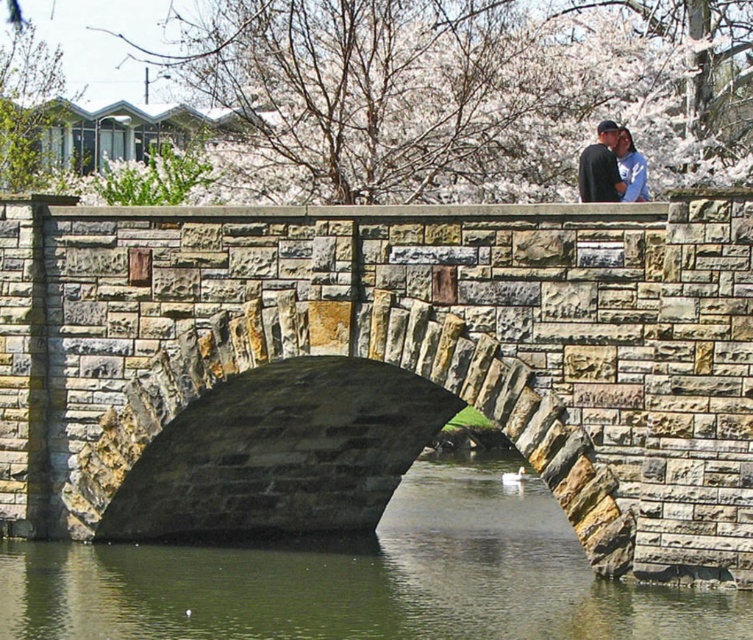
Question: Based on their relative distances, which object is nearer to the blue denim jacket at upper center?

Choices:
 (A) natural stone bridge at center
 (B) green stone river at center
 (C) matte black jacket at upper center

Answer: (C)

Question: Considering the relative positions of natural stone bridge at center and blue denim jacket at upper center in the image provided, where is natural stone bridge at center located with respect to blue denim jacket at upper center?

Choices:
 (A) left
 (B) right

Answer: (A)

Question: Does natural stone bridge at center lie in front of blue denim jacket at upper center?

Choices:
 (A) yes
 (B) no

Answer: (A)

Question: Among these objects, which one is nearest to the camera?

Choices:
 (A) green stone river at center
 (B) blue denim jacket at upper center
 (C) natural stone bridge at center
 (D) matte black jacket at upper center

Answer: (A)

Question: Estimate the real-world distances between objects in this image. Which object is farther from the green stone river at center?

Choices:
 (A) blue denim jacket at upper center
 (B) matte black jacket at upper center

Answer: (A)

Question: Can you confirm if natural stone bridge at center is bigger than matte black jacket at upper center?

Choices:
 (A) no
 (B) yes

Answer: (B)